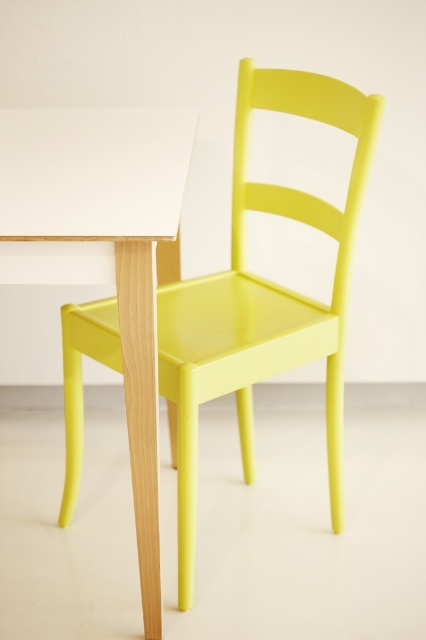
Can you confirm if lime matte chair at center is positioned to the right of white matte table at center?

Indeed, lime matte chair at center is positioned on the right side of white matte table at center.

Does lime matte chair at center have a greater width compared to white matte table at center?

Yes, lime matte chair at center is wider than white matte table at center.

This screenshot has width=426, height=640. What do you see at coordinates (262, 296) in the screenshot?
I see `lime matte chair at center` at bounding box center [262, 296].

Image resolution: width=426 pixels, height=640 pixels. In order to click on lime matte chair at center in this screenshot , I will do [x=262, y=296].